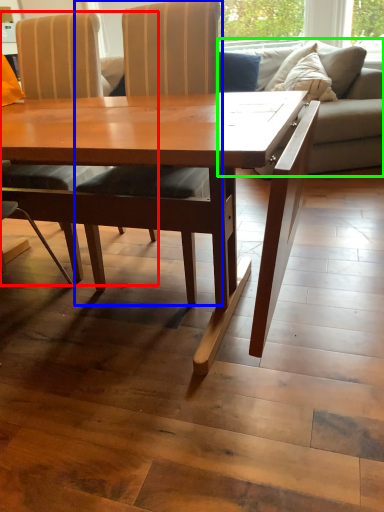
Question: Which is nearer to the chair (highlighted by a red box)? chair (highlighted by a blue box) or studio couch (highlighted by a green box).

Choices:
 (A) chair
 (B) studio couch

Answer: (A)